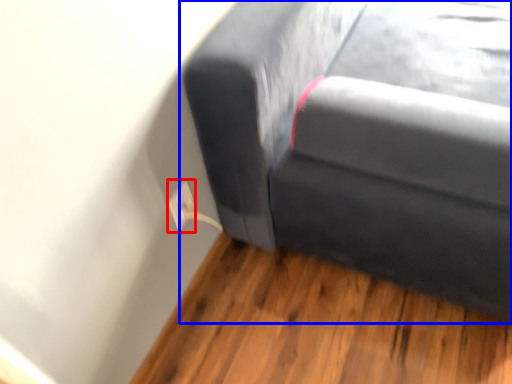
Question: Among these objects, which one is farthest to the camera, electric outlet (highlighted by a red box) or studio couch (highlighted by a blue box)?

Choices:
 (A) electric outlet
 (B) studio couch

Answer: (A)